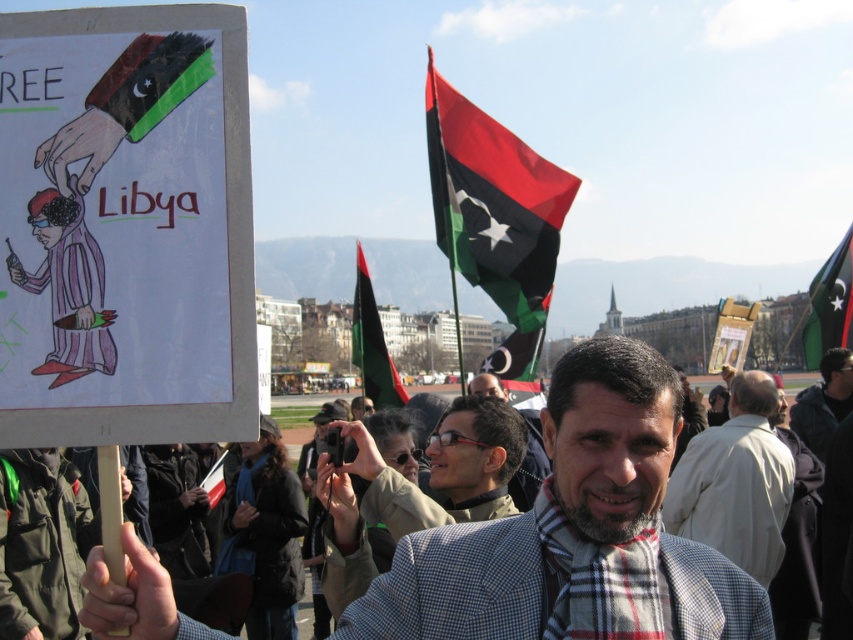
Can you confirm if checkered wool scarf at center is positioned below red fabric flag at upper center?

Correct, checkered wool scarf at center is located below red fabric flag at upper center.

Consider the image. Is checkered wool scarf at center closer to the viewer compared to red fabric flag at upper center?

Yes.

The image size is (853, 640). Describe the element at coordinates (575, 532) in the screenshot. I see `checkered wool scarf at center` at that location.

At what (x,y) coordinates should I click in order to perform the action: click on checkered wool scarf at center. Please return your answer as a coordinate pair (x, y). Looking at the image, I should click on (575, 532).

Does point (131, 316) lie behind point (352, 333)?

That is False.

You are a GUI agent. You are given a task and a screenshot of the screen. Output one action in this format:
    pyautogui.click(x=<x>, y=<y>)
    Task: Click on the white paper poster at upper left
    
    Given the screenshot: What is the action you would take?
    pyautogui.click(x=125, y=227)

Between point (16, 173) and point (369, 323), which one is positioned in front?

Point (16, 173) is more forward.

Where is `white paper poster at upper left`? This screenshot has height=640, width=853. white paper poster at upper left is located at coordinates (125, 227).

Can you confirm if plaid scarf at center is shorter than matte paper poster at center?

In fact, plaid scarf at center may be taller than matte paper poster at center.

You are a GUI agent. You are given a task and a screenshot of the screen. Output one action in this format:
    pyautogui.click(x=<x>, y=<y>)
    Task: Click on the plaid scarf at center
    The height and width of the screenshot is (640, 853).
    Given the screenshot: What is the action you would take?
    pyautogui.click(x=415, y=488)

I want to click on plaid scarf at center, so click(415, 488).